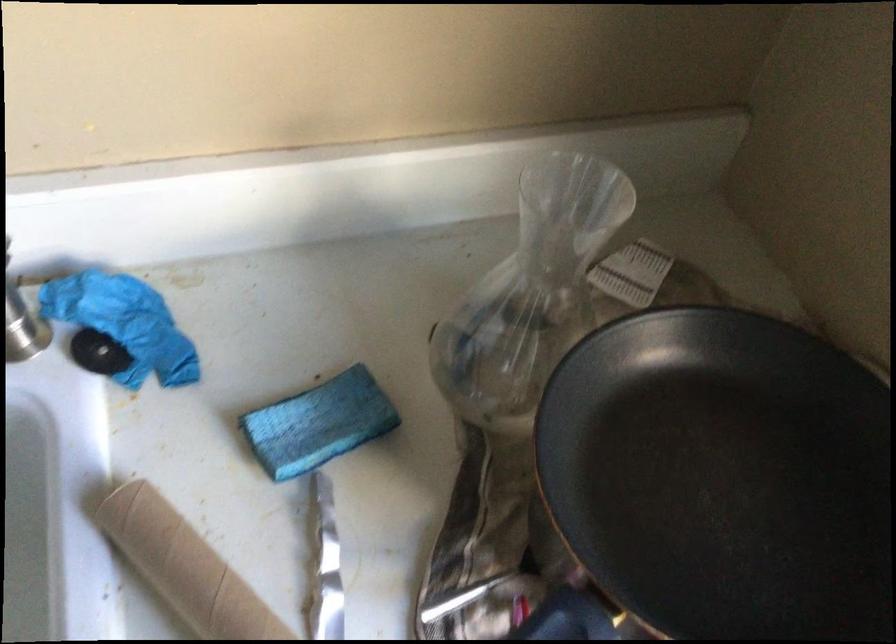
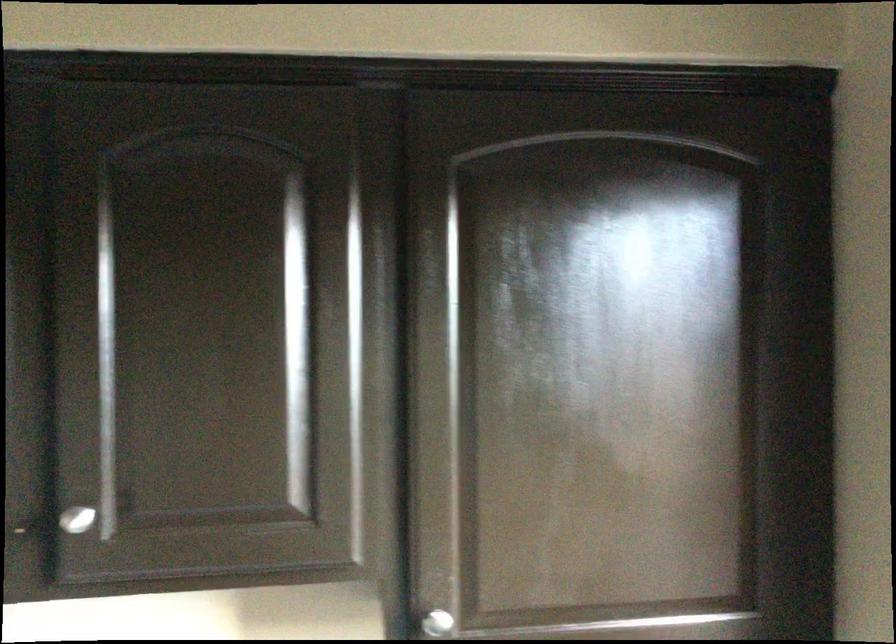
Looking at this image, how did the camera likely rotate?

The rotation direction of the camera is left-up.